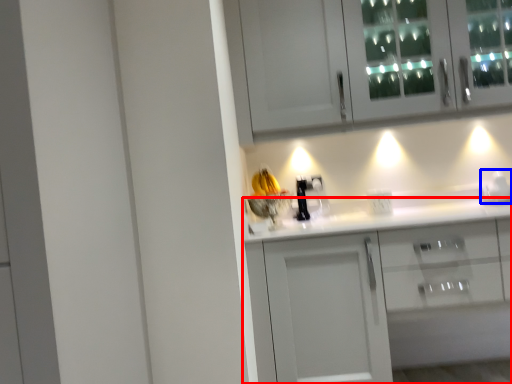
Question: Which object is further to the camera taking this photo, cabinetry (highlighted by a red box) or appliance (highlighted by a blue box)?

Choices:
 (A) cabinetry
 (B) appliance

Answer: (B)